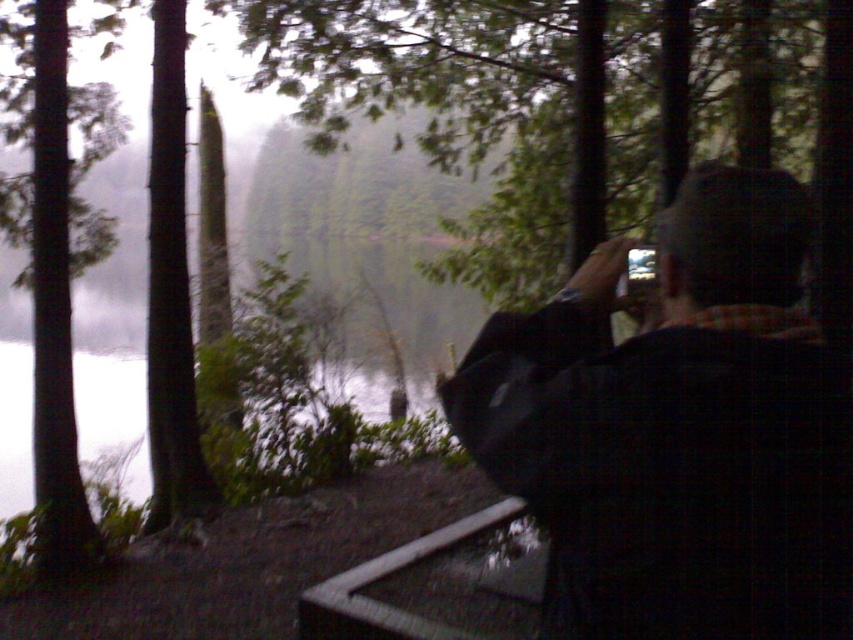
Question: Which object is farther from the camera taking this photo?

Choices:
 (A) dark fabric jacket at right
 (B) green matte tree at left

Answer: (B)

Question: Can you confirm if dark fabric jacket at right is bigger than green matte tree at left?

Choices:
 (A) no
 (B) yes

Answer: (B)

Question: Is the position of dark fabric jacket at right more distant than that of green matte tree at left?

Choices:
 (A) no
 (B) yes

Answer: (A)

Question: Among these points, which one is farthest from the camera?

Choices:
 (A) (793, 497)
 (B) (48, 529)

Answer: (B)

Question: From the image, what is the correct spatial relationship of dark fabric jacket at right in relation to green matte tree at left?

Choices:
 (A) above
 (B) below

Answer: (B)

Question: Which object is closer to the camera taking this photo?

Choices:
 (A) dark fabric jacket at right
 (B) green matte tree at left

Answer: (A)